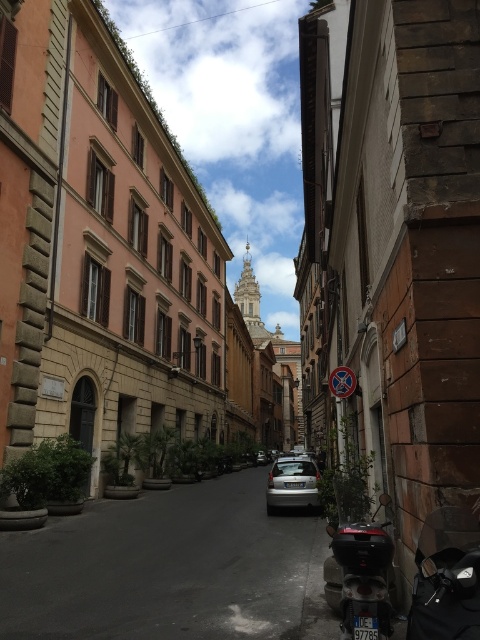
What do you see at coordinates (169, 568) in the screenshot? I see `silver metallic car at center` at bounding box center [169, 568].

Between point (192, 579) and point (376, 611), which one is positioned in front?

Point (376, 611) is in front.

Between point (88, 618) and point (339, 605), which one is positioned behind?

Positioned behind is point (88, 618).

Where is `silver metallic car at center`? silver metallic car at center is located at coordinates pyautogui.click(x=169, y=568).

Which of these two, shiny black motorcycle at lower right or metallic red scooter at lower right, stands shorter?

metallic red scooter at lower right is shorter.

Does shiny black motorcycle at lower right have a lesser height compared to metallic red scooter at lower right?

In fact, shiny black motorcycle at lower right may be taller than metallic red scooter at lower right.

Where is `shiny black motorcycle at lower right`? shiny black motorcycle at lower right is located at coordinates (445, 577).

At what (x,y) coordinates should I click in order to perform the action: click on shiny black motorcycle at lower right. Please return your answer as a coordinate pair (x, y). The image size is (480, 640). Looking at the image, I should click on (445, 577).

Is silver metallic car at center to the left of shiny black motorcycle at lower right from the viewer's perspective?

Correct, you'll find silver metallic car at center to the left of shiny black motorcycle at lower right.

Is point (133, 630) more distant than point (443, 509)?

That is True.

The image size is (480, 640). What do you see at coordinates (169, 568) in the screenshot?
I see `silver metallic car at center` at bounding box center [169, 568].

Identify the location of silver metallic car at center. (169, 568).